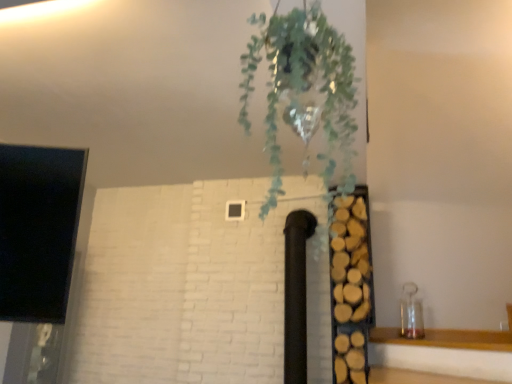
Question: Considering the relative sizes of green leafy plant at upper center and wooden logs at right in the image provided, is green leafy plant at upper center bigger than wooden logs at right?

Choices:
 (A) yes
 (B) no

Answer: (B)

Question: Considering the relative positions of green leafy plant at upper center and wooden logs at right in the image provided, is green leafy plant at upper center behind wooden logs at right?

Choices:
 (A) yes
 (B) no

Answer: (B)

Question: Does green leafy plant at upper center have a lesser height compared to wooden logs at right?

Choices:
 (A) no
 (B) yes

Answer: (B)

Question: Is green leafy plant at upper center not close to wooden logs at right?

Choices:
 (A) no
 (B) yes

Answer: (B)

Question: Is green leafy plant at upper center next to wooden logs at right and touching it?

Choices:
 (A) yes
 (B) no

Answer: (B)

Question: From the image's perspective, would you say green leafy plant at upper center is shown under wooden logs at right?

Choices:
 (A) yes
 (B) no

Answer: (B)

Question: Is wooden logs at right taller than green leafy plant at upper center?

Choices:
 (A) yes
 (B) no

Answer: (A)

Question: Is wooden logs at right located outside green leafy plant at upper center?

Choices:
 (A) yes
 (B) no

Answer: (A)

Question: Is wooden logs at right not near green leafy plant at upper center?

Choices:
 (A) yes
 (B) no

Answer: (A)

Question: Can you confirm if wooden logs at right is shorter than green leafy plant at upper center?

Choices:
 (A) yes
 (B) no

Answer: (B)

Question: From a real-world perspective, is wooden logs at right under green leafy plant at upper center?

Choices:
 (A) no
 (B) yes

Answer: (B)

Question: Can green leafy plant at upper center be found inside wooden logs at right?

Choices:
 (A) no
 (B) yes

Answer: (A)

Question: Would you say green leafy plant at upper center is inside or outside wooden logs at right?

Choices:
 (A) outside
 (B) inside

Answer: (A)